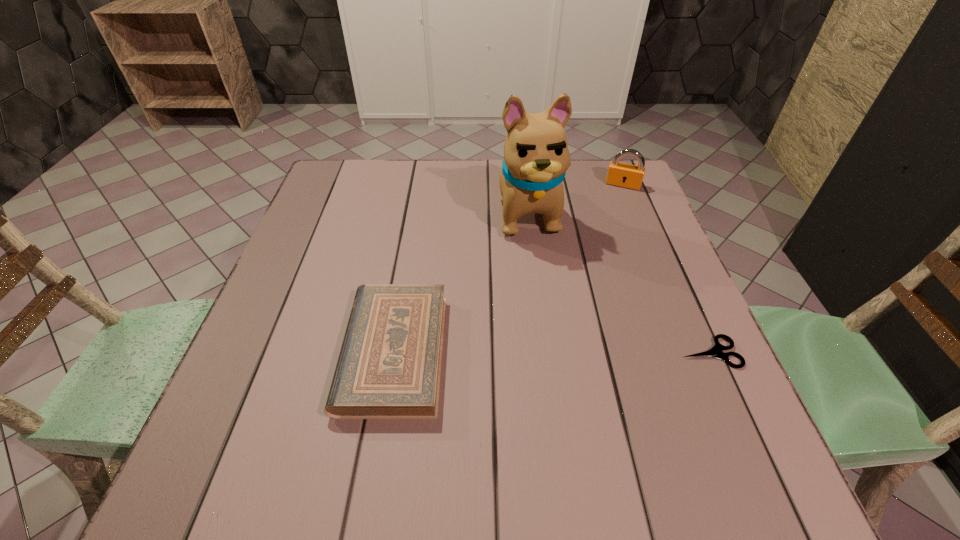
You are a GUI agent. You are given a task and a screenshot of the screen. Output one action in this format:
    pyautogui.click(x=<x>, y=<y>)
    Task: Click on the blank area located 0.120m on the face of the third object from right to left
    The height and width of the screenshot is (540, 960).
    Given the screenshot: What is the action you would take?
    pyautogui.click(x=545, y=280)

Locate an element on the screen. This screenshot has width=960, height=540. vacant space located 0.390m on the face of the third object from right to left is located at coordinates (576, 384).

I want to click on free location located 0.400m on the face of the third object from right to left, so click(x=577, y=389).

Locate an element on the screen. This screenshot has height=540, width=960. vacant space located 0.140m to unlock the padlock from the front is located at coordinates (611, 219).

This screenshot has height=540, width=960. In order to click on vacant region located to unlock the padlock from the front in this screenshot , I will do `click(598, 257)`.

Locate an element on the screen. free point located to unlock the padlock from the front is located at coordinates click(612, 212).

Locate an element on the screen. This screenshot has width=960, height=540. puppy at the far edge is located at coordinates (536, 156).

This screenshot has height=540, width=960. I want to click on padlock located at the far edge, so click(x=619, y=174).

The image size is (960, 540). Find the location of `object that is at the near edge`. object that is at the near edge is located at coordinates (389, 366).

Where is `shears located at the right edge`? This screenshot has width=960, height=540. shears located at the right edge is located at coordinates (716, 351).